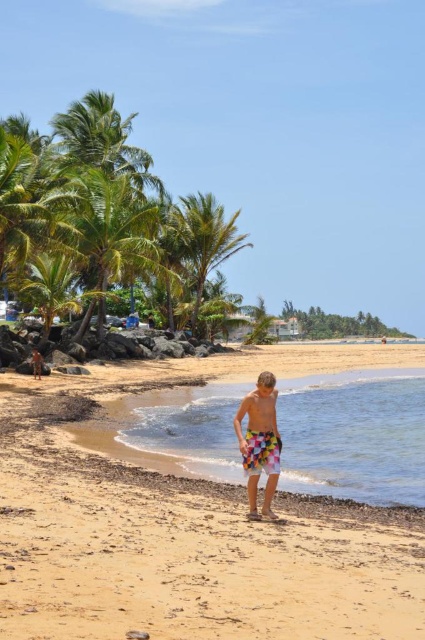
You are standing on the beach and see the multicolored fabric shorts at center and the green leafy palm tree at center. Which object is positioned to the right side of the other?

The multicolored fabric shorts at center is to the right of the green leafy palm tree at center.

You are standing on the beach and want to place a small seashell on the smooth golden sand at center. If you walk towards the clear water at lower center, will the seashell become visible from your new position?

The smooth golden sand at center is closer to the viewer than the clear water at lower center. Since the sand is closer, placing the seashell there means it will remain visible even as you move toward the water.

You are a photographer trying to capture the multicolored fabric shorts at center in the image. Based on the coordinates provided, where should you position your camera to ensure the shorts are centered in your shot?

The multicolored fabric shorts at center are located at coordinates point (260, 442), so you should position your camera to focus on that point to center them in your shot.